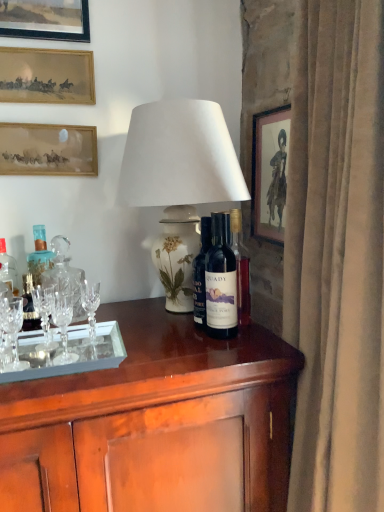
Question: From the image's perspective, is matte gold picture frame at upper left, which is the second picture frame from right to left, positioned above or below matte wooden picture frame at upper left, marked as the second picture frame in a left-to-right arrangement?

Choices:
 (A) below
 (B) above

Answer: (B)

Question: In the image, is matte gold picture frame at upper left, the third picture frame from the left, positioned in front of or behind matte wooden picture frame at upper left, placed as the third picture frame when sorted from top to bottom?

Choices:
 (A) front
 (B) behind

Answer: (A)

Question: Which object is positioned closest to the white ceramic lamp at center?

Choices:
 (A) dark blue glass bottle at center
 (B) wooden framed picture at upper right, which is the first picture frame from right to left
 (C) glossy wood desk at center
 (D) clear glass bottle at left, acting as the third bottle starting from the right
 (E) matte gold picture frame at upper left, which is the second picture frame from right to left

Answer: (A)

Question: Considering the real-world distances, which object is farthest from the clear glass bottle at left, arranged as the 1th bottle when viewed from the left?

Choices:
 (A) clear crystal wine glass at left
 (B) dark blue glass bottle at center, which is counted as the third bottle, starting from the left
 (C) dark blue glass bottle at center, placed as the second bottle when sorted from right to left
 (D) wooden framed picture at upper right, which is the first picture frame from right to left
 (E) dark blue glass bottle at center

Answer: (D)